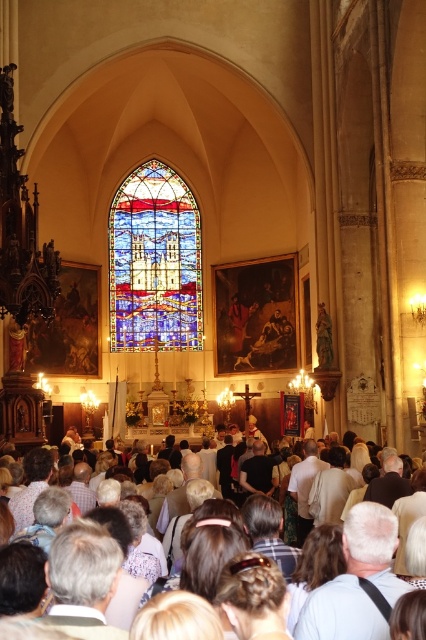
You are standing in the grand church and want to take a photo of both the stained glass window at center and the white clothed crowd at center. Which object should you point your camera towards first to capture both in the frame?

The stained glass window at center is positioned on the left side of white clothed crowd at center, so you should aim your camera towards the stained glass window at center first to ensure both objects are included in the frame.